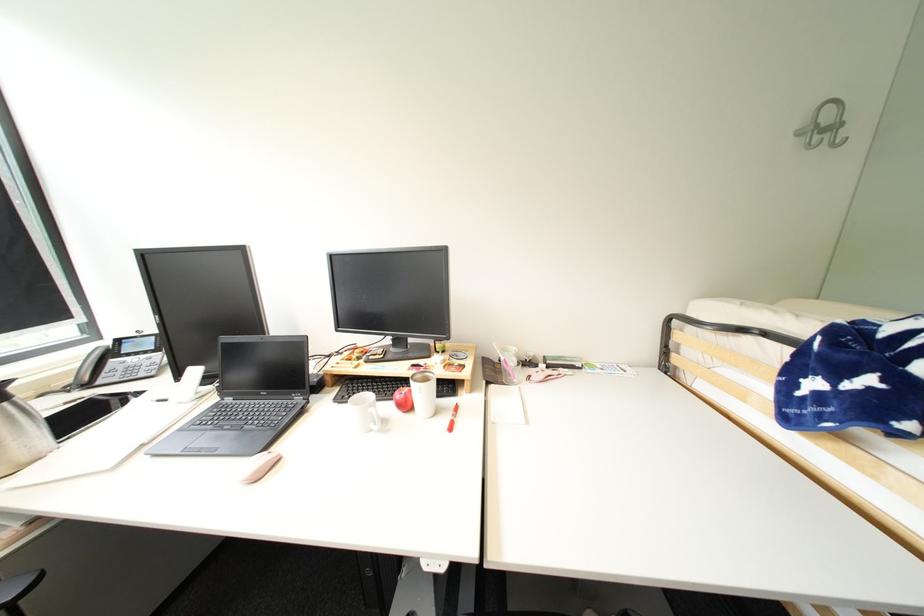
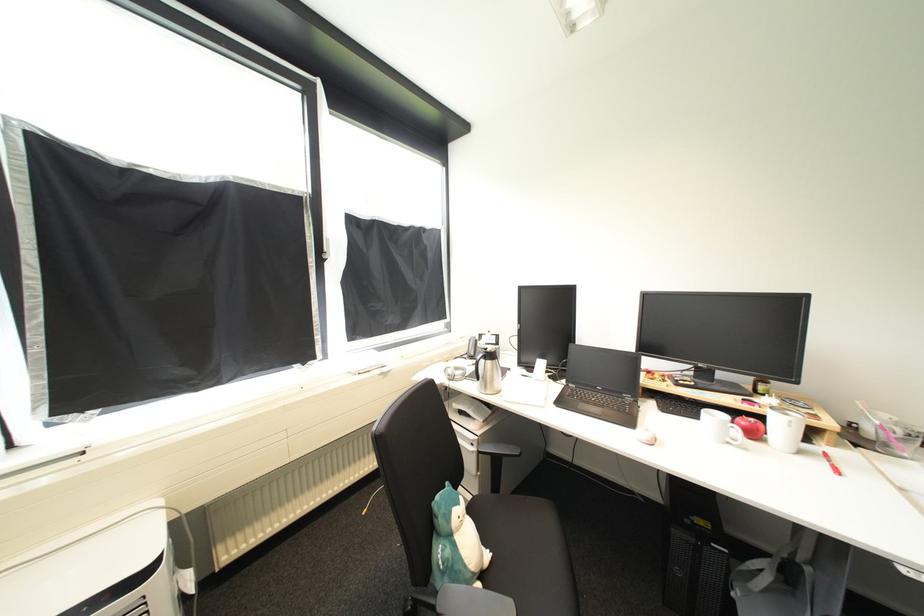
Where in the second image is the point corresponding to point (410, 570) from the first image?

(745, 591)